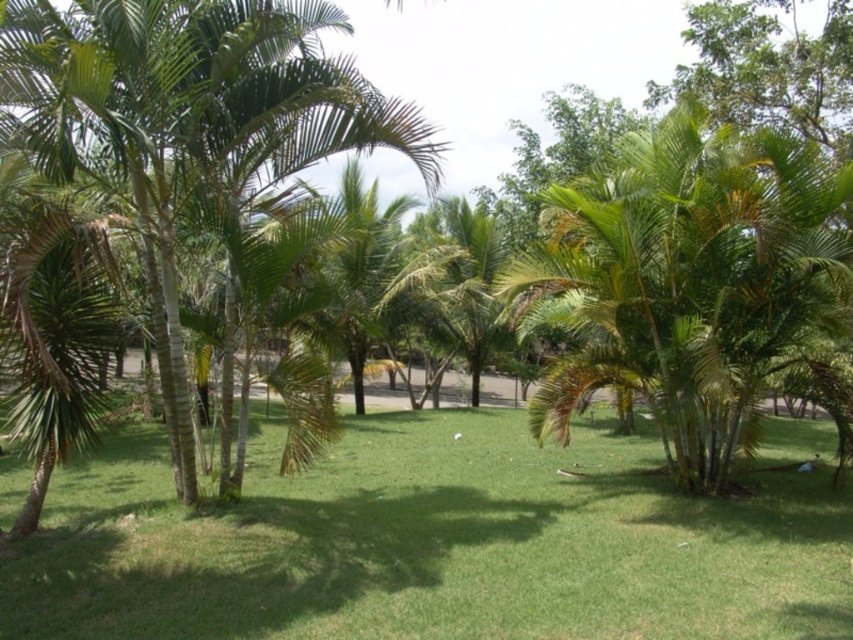
Is green grass at center positioned before green leafy palm tree at center?

That is True.

Is point (496, 570) closer to viewer compared to point (686, 456)?

That is True.

Identify the location of green grass at center. (438, 541).

Is point (358, 92) positioned in front of point (761, 348)?

Yes, it is.

Image resolution: width=853 pixels, height=640 pixels. I want to click on green leafy palm tree at left, so click(x=199, y=145).

Can you confirm if green grass at center is wider than green leafy palm tree at left?

Indeed, green grass at center has a greater width compared to green leafy palm tree at left.

What do you see at coordinates (438, 541) in the screenshot? I see `green grass at center` at bounding box center [438, 541].

Identify the location of green grass at center. Image resolution: width=853 pixels, height=640 pixels. (438, 541).